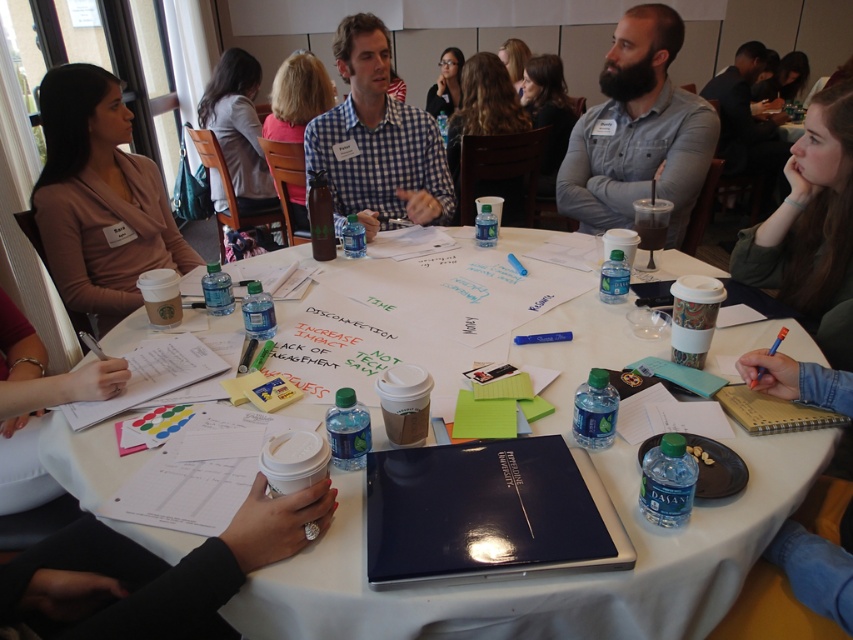
Can you confirm if matte black laptop at center is shorter than matte brown sweater at upper left?

Yes.

Based on the photo, which of these two, matte black laptop at center or matte brown sweater at upper left, stands taller?

With more height is matte brown sweater at upper left.

Locate an element on the screen. matte black laptop at center is located at coordinates (549, 576).

Looking at this image, is matte black laptop at center to the right of checkered fabric shirt at center from the viewer's perspective?

Indeed, matte black laptop at center is positioned on the right side of checkered fabric shirt at center.

Between matte black laptop at center and checkered fabric shirt at center, which one appears on the left side from the viewer's perspective?

checkered fabric shirt at center

Which is in front, point (703, 547) or point (405, 141)?

Point (703, 547)

You are a GUI agent. You are given a task and a screenshot of the screen. Output one action in this format:
    pyautogui.click(x=<x>, y=<y>)
    Task: Click on the matte black laptop at center
    
    Given the screenshot: What is the action you would take?
    pyautogui.click(x=549, y=576)

Does matte brown sweater at upper left have a lesser width compared to checkered fabric shirt at center?

Yes.

The image size is (853, 640). What do you see at coordinates (99, 196) in the screenshot?
I see `matte brown sweater at upper left` at bounding box center [99, 196].

The height and width of the screenshot is (640, 853). In order to click on matte brown sweater at upper left in this screenshot , I will do `click(99, 196)`.

I want to click on matte brown sweater at upper left, so click(x=99, y=196).